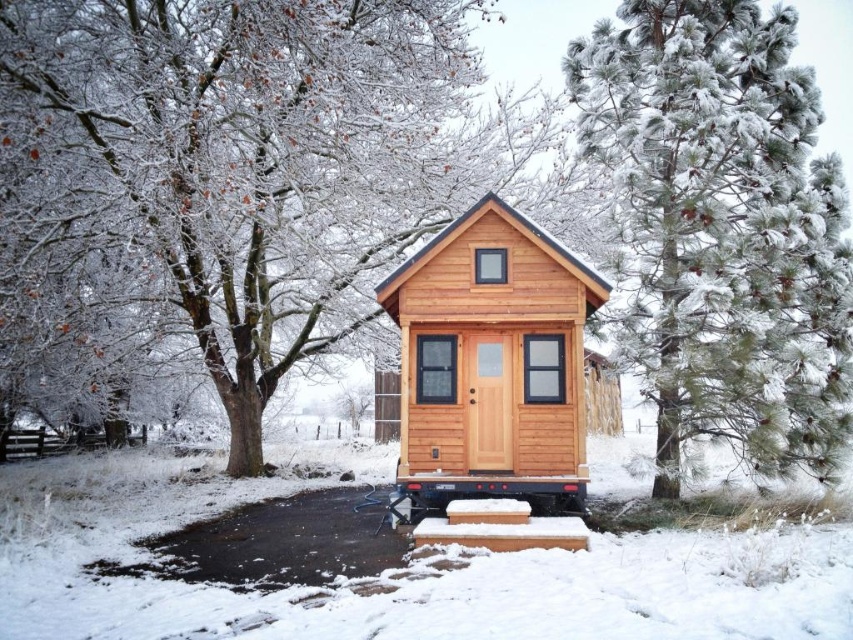
You are standing in front of the cabin and want to determine which of the two points, point (848,292) or point (422,371), is closer to you. Based on the cabin and its surroundings, which point is nearer?

Point (848,292) is closer to the viewer than point (422,371).